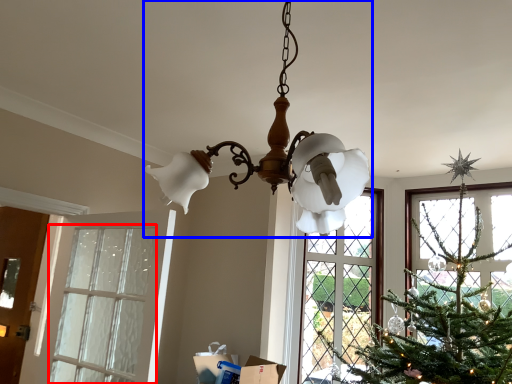
Question: Which of the following is the farthest to the observer, window (highlighted by a red box) or lamp (highlighted by a blue box)?

Choices:
 (A) window
 (B) lamp

Answer: (A)